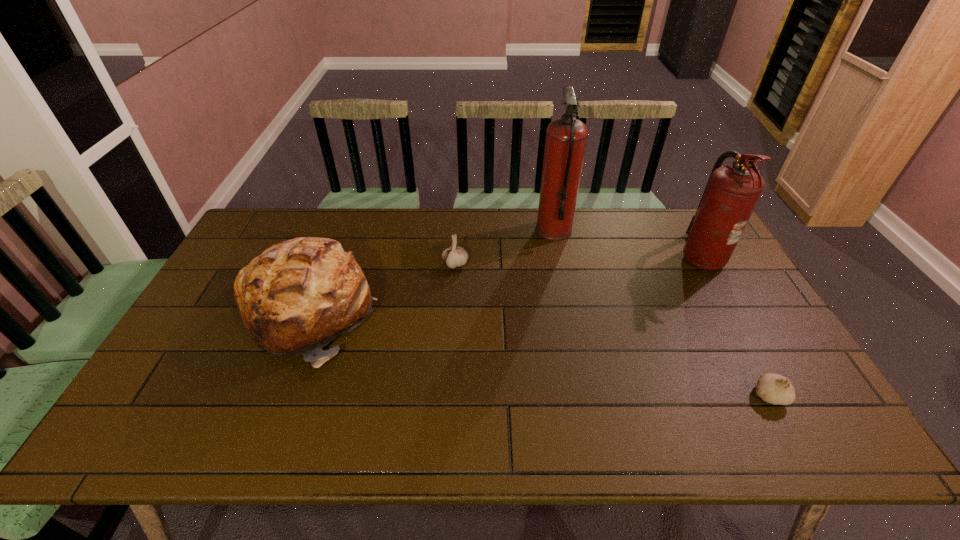
At what (x,y) coordinates should I click in order to perform the action: click on free space between the shorter garlic and the second object from left to right. Please return your answer as a coordinate pair (x, y). Image resolution: width=960 pixels, height=540 pixels. Looking at the image, I should click on (612, 330).

This screenshot has width=960, height=540. I want to click on free space between the right fire extinguisher and the left fire extinguisher, so click(x=627, y=243).

Identify the location of free area in between the second shortest object and the third shortest object. (382, 289).

Where is `free space between the second tallest object and the left garlic`? free space between the second tallest object and the left garlic is located at coordinates (578, 260).

Where is `unoccupied position between the farther garlic and the second tallest object`? This screenshot has height=540, width=960. unoccupied position between the farther garlic and the second tallest object is located at coordinates (578, 260).

Locate an element on the screen. vacant space that is in between the fourth shortest object and the third shortest object is located at coordinates (505, 285).

Locate an element on the screen. This screenshot has width=960, height=540. empty space that is in between the leftmost object and the third object from left to right is located at coordinates (431, 272).

The height and width of the screenshot is (540, 960). I want to click on empty space that is in between the taller garlic and the leftmost object, so tap(382, 289).

The width and height of the screenshot is (960, 540). I want to click on object that is the second closest to the shorter fire extinguisher, so click(x=775, y=389).

The image size is (960, 540). I want to click on object that is the second closest to the left garlic, so click(566, 137).